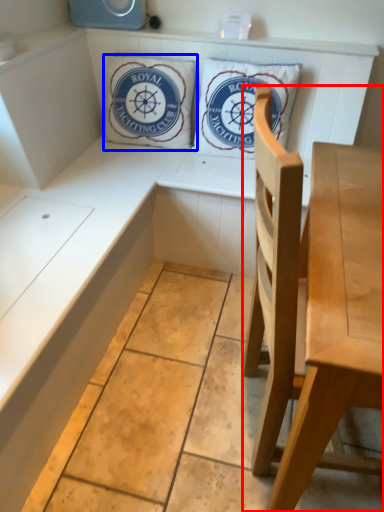
Question: Which of the following is the farthest to the observer, chair (highlighted by a red box) or pillow (highlighted by a blue box)?

Choices:
 (A) chair
 (B) pillow

Answer: (B)